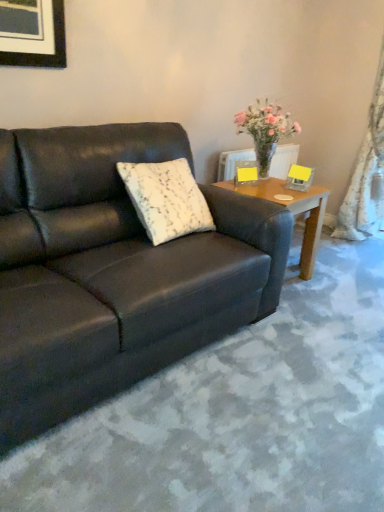
Question: From a real-world perspective, does white lace curtain at right sit lower than white textured pillow at center?

Choices:
 (A) yes
 (B) no

Answer: (B)

Question: From the image's perspective, is white lace curtain at right on white textured pillow at center?

Choices:
 (A) yes
 (B) no

Answer: (A)

Question: From a real-world perspective, does white lace curtain at right stand above white textured pillow at center?

Choices:
 (A) yes
 (B) no

Answer: (A)

Question: Is white lace curtain at right turned away from white textured pillow at center?

Choices:
 (A) yes
 (B) no

Answer: (B)

Question: Is white lace curtain at right next to white textured pillow at center and touching it?

Choices:
 (A) no
 (B) yes

Answer: (A)

Question: Is white lace curtain at right not within white textured pillow at center?

Choices:
 (A) no
 (B) yes

Answer: (B)

Question: Are matte black couch at center and white textured pillow at center making contact?

Choices:
 (A) no
 (B) yes

Answer: (A)

Question: Is matte black couch at center to the right of white textured pillow at center from the viewer's perspective?

Choices:
 (A) no
 (B) yes

Answer: (A)

Question: Does matte black couch at center have a larger size compared to white textured pillow at center?

Choices:
 (A) no
 (B) yes

Answer: (B)

Question: Considering the relative sizes of matte black couch at center and white textured pillow at center in the image provided, is matte black couch at center wider than white textured pillow at center?

Choices:
 (A) no
 (B) yes

Answer: (B)

Question: Is matte black couch at center facing away from white textured pillow at center?

Choices:
 (A) no
 (B) yes

Answer: (B)

Question: From the image's perspective, does matte black couch at center appear higher than white textured pillow at center?

Choices:
 (A) no
 (B) yes

Answer: (A)

Question: Is wooden side table at right oriented away from white lace curtain at right?

Choices:
 (A) no
 (B) yes

Answer: (A)